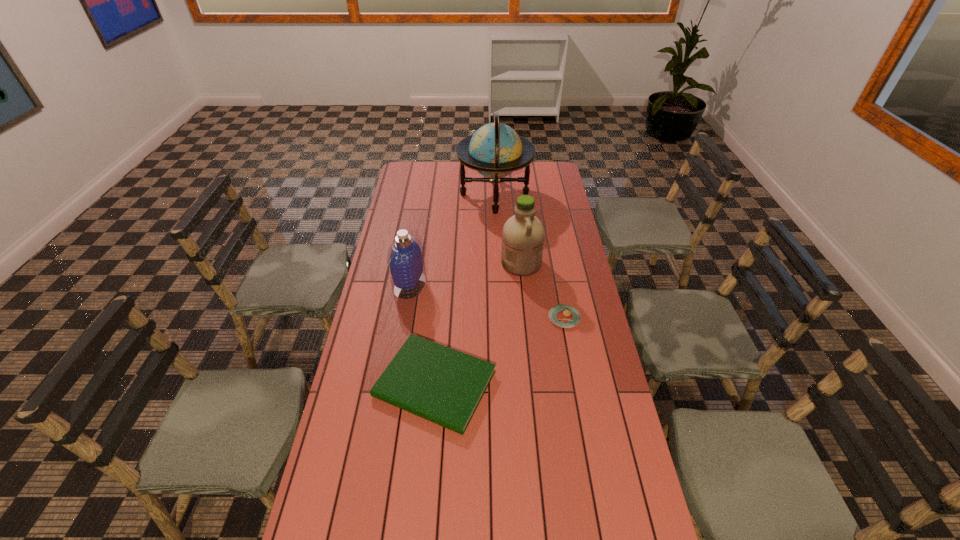
Point out which object is positioned as the nearest to the second nearest object. Please provide its 2D coordinates. Your answer should be formatted as a tuple, i.e. [(x, y)], where the tuple contains the x and y coordinates of a point satisfying the conditions above.

[(523, 234)]

You are a GUI agent. You are given a task and a screenshot of the screen. Output one action in this format:
    pyautogui.click(x=<x>, y=<y>)
    Task: Click on the free location that satisfies the following two spatial constraints: 1. on the surface of the farthest object; 2. on the right side of the fourth farthest object
    
    Given the screenshot: What is the action you would take?
    pyautogui.click(x=500, y=318)

Identify the location of vacant space that satisfies the following two spatial constraints: 1. on the surface of the farthest object; 2. on the front side of the shorter cleansing agent. (498, 285).

This screenshot has height=540, width=960. Find the location of `vacant space that satisfies the following two spatial constraints: 1. on the front side of the left cleansing agent; 2. on the left side of the second nearest object`. vacant space that satisfies the following two spatial constraints: 1. on the front side of the left cleansing agent; 2. on the left side of the second nearest object is located at coordinates (404, 318).

Where is `vacant space that satisfies the following two spatial constraints: 1. on the back side of the pastry; 2. on the front label of the taller cleansing agent`? This screenshot has width=960, height=540. vacant space that satisfies the following two spatial constraints: 1. on the back side of the pastry; 2. on the front label of the taller cleansing agent is located at coordinates (554, 264).